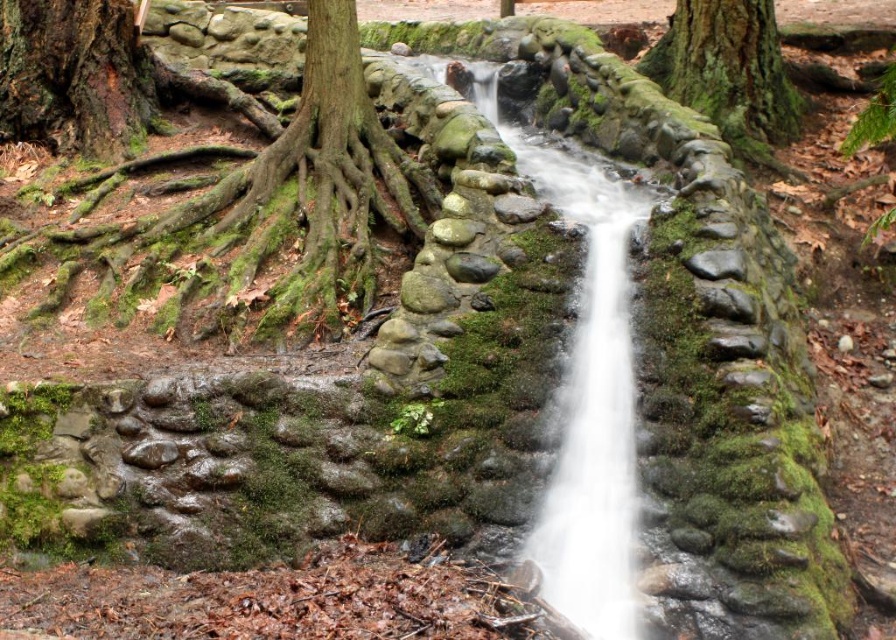
Locate an element on the screen. This screenshot has height=640, width=896. green mossy roots at left is located at coordinates (270, 196).

What do you see at coordinates (270, 196) in the screenshot? The image size is (896, 640). I see `green mossy roots at left` at bounding box center [270, 196].

Image resolution: width=896 pixels, height=640 pixels. Find the location of `green mossy roots at left`. green mossy roots at left is located at coordinates (270, 196).

Who is more distant from viewer, (100,12) or (739,74)?

Point (739,74)

Between green mossy roots at left and green mossy tree trunk at upper right, which one has less height?

green mossy tree trunk at upper right is shorter.

Is point (342, 268) in front of point (763, 131)?

Yes, point (342, 268) is in front of point (763, 131).

The height and width of the screenshot is (640, 896). In order to click on green mossy roots at left in this screenshot , I will do `click(270, 196)`.

Is green mossy stone stream at center above green mossy tree trunk at upper right?

No.

The width and height of the screenshot is (896, 640). Describe the element at coordinates (587, 394) in the screenshot. I see `green mossy stone stream at center` at that location.

The height and width of the screenshot is (640, 896). What are the coordinates of `green mossy stone stream at center` in the screenshot? It's located at (587, 394).